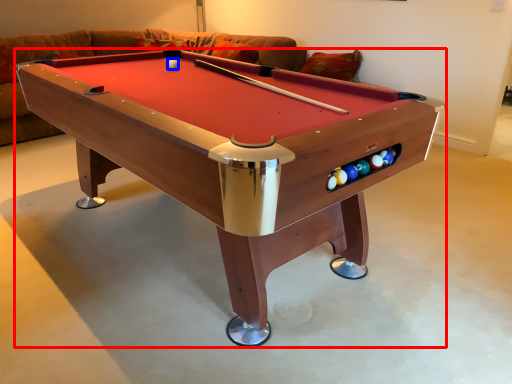
Question: Which object appears farthest to the camera in this image, billiard table (highlighted by a red box) or ball (highlighted by a blue box)?

Choices:
 (A) billiard table
 (B) ball

Answer: (B)